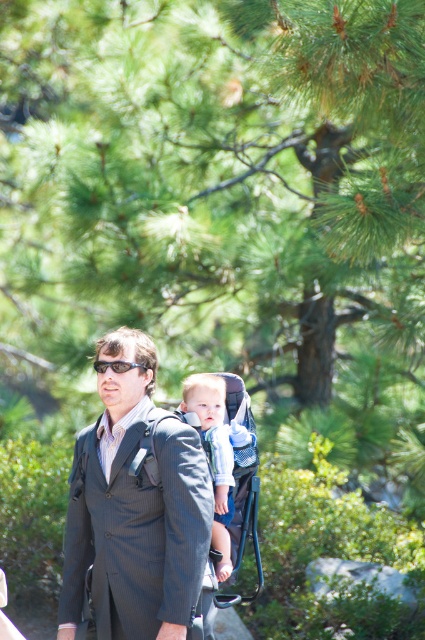
Question: Which point appears farthest from the camera in this image?

Choices:
 (A) 227,500
 (B) 127,368

Answer: (A)

Question: Is dark gray suit at center wider than light blue denim shirt at center?

Choices:
 (A) yes
 (B) no

Answer: (A)

Question: Which of these objects is positioned farthest from the light blue denim shirt at center?

Choices:
 (A) black plastic sunglasses at center
 (B) dark gray suit at center

Answer: (A)

Question: Considering the real-world distances, which object is farthest from the black plastic sunglasses at center?

Choices:
 (A) dark gray suit at center
 (B) light blue denim shirt at center

Answer: (B)

Question: In this image, where is light blue denim shirt at center located relative to black plastic sunglasses at center?

Choices:
 (A) above
 (B) below

Answer: (B)

Question: Considering the relative positions of dark gray suit at center and light blue denim shirt at center in the image provided, where is dark gray suit at center located with respect to light blue denim shirt at center?

Choices:
 (A) below
 (B) above

Answer: (B)